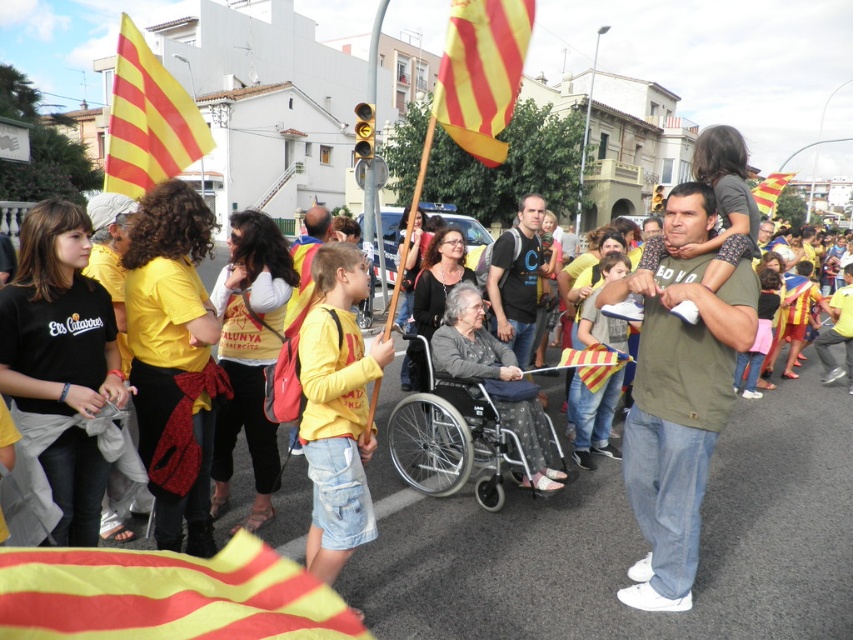
You are a photographer standing at the center of the street scene. You notice a point marked at coordinate (677, 396). Which object from the scene is located exactly at that point?

The point at coordinate (677, 396) corresponds to the matte green t shirt at center.